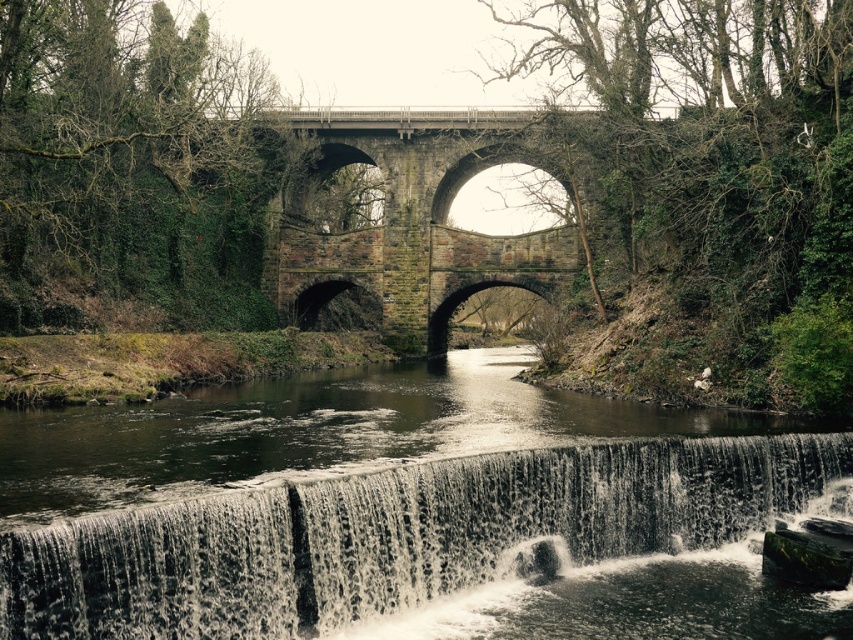
You are a photographer standing at the stone bridge and want to capture the dark gray textured water at lower center. Where exactly should you position your camera to best capture this feature?

To best capture the dark gray textured water at lower center, position your camera at point (397, 536) as specified in the scene description.

You are a tourist standing on the stone arch bridge at center. Looking down, you see the dark gray textured water at lower center. How does the height of the water compare to the bridge?

The dark gray textured water at lower center is shorter than the stone arch bridge at center, meaning the bridge is taller than the water.